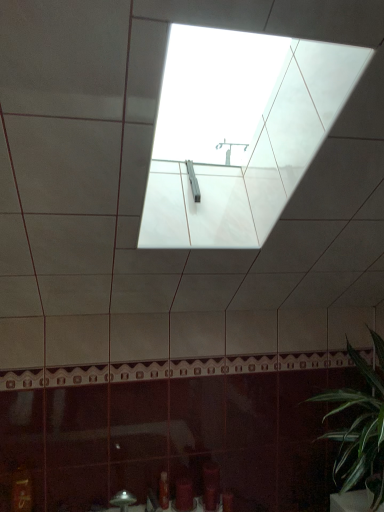
Question: Which direction should I rotate to look at translucent plastic bottle at lower center, acting as the 1th toiletry starting from the left, — up or down?

Choices:
 (A) up
 (B) down

Answer: (B)

Question: Is translucent plastic bottle at lower center, acting as the 1th toiletry starting from the left, bigger than matte red toiletry at lower center, arranged as the second toiletry when viewed from the left?

Choices:
 (A) yes
 (B) no

Answer: (B)

Question: Can you confirm if translucent plastic bottle at lower center, positioned as the 2th toiletry in right-to-left order, is positioned to the left of matte red toiletry at lower center, arranged as the second toiletry when viewed from the left?

Choices:
 (A) yes
 (B) no

Answer: (A)

Question: Can you confirm if translucent plastic bottle at lower center, acting as the 1th toiletry starting from the left, is shorter than matte red toiletry at lower center, the 1th toiletry from the right?

Choices:
 (A) no
 (B) yes

Answer: (A)

Question: Is translucent plastic bottle at lower center, positioned as the 2th toiletry in right-to-left order, looking in the opposite direction of matte red toiletry at lower center, arranged as the second toiletry when viewed from the left?

Choices:
 (A) yes
 (B) no

Answer: (B)

Question: Is matte red toiletry at lower center, arranged as the second toiletry when viewed from the left, located within translucent plastic bottle at lower center, acting as the 1th toiletry starting from the left?

Choices:
 (A) yes
 (B) no

Answer: (B)

Question: Can you confirm if translucent plastic bottle at lower center, acting as the 1th toiletry starting from the left, is wider than matte red toiletry at lower center, arranged as the second toiletry when viewed from the left?

Choices:
 (A) yes
 (B) no

Answer: (B)

Question: Considering the relative sizes of green leafy plant at lower right and matte red toiletry at lower center, the 1th toiletry from the right, in the image provided, is green leafy plant at lower right shorter than matte red toiletry at lower center, the 1th toiletry from the right,?

Choices:
 (A) no
 (B) yes

Answer: (A)

Question: Is green leafy plant at lower right positioned behind matte red toiletry at lower center, arranged as the second toiletry when viewed from the left?

Choices:
 (A) no
 (B) yes

Answer: (A)

Question: Is green leafy plant at lower right bigger than matte red toiletry at lower center, arranged as the second toiletry when viewed from the left?

Choices:
 (A) yes
 (B) no

Answer: (A)

Question: Is green leafy plant at lower right not inside matte red toiletry at lower center, arranged as the second toiletry when viewed from the left?

Choices:
 (A) no
 (B) yes

Answer: (B)

Question: From the image's perspective, is green leafy plant at lower right above matte red toiletry at lower center, the 1th toiletry from the right?

Choices:
 (A) yes
 (B) no

Answer: (A)

Question: From a real-world perspective, does green leafy plant at lower right stand above matte red toiletry at lower center, the 1th toiletry from the right?

Choices:
 (A) yes
 (B) no

Answer: (A)

Question: From a real-world perspective, is matte red toiletry at lower center, arranged as the second toiletry when viewed from the left, on top of green leafy plant at lower right?

Choices:
 (A) yes
 (B) no

Answer: (B)